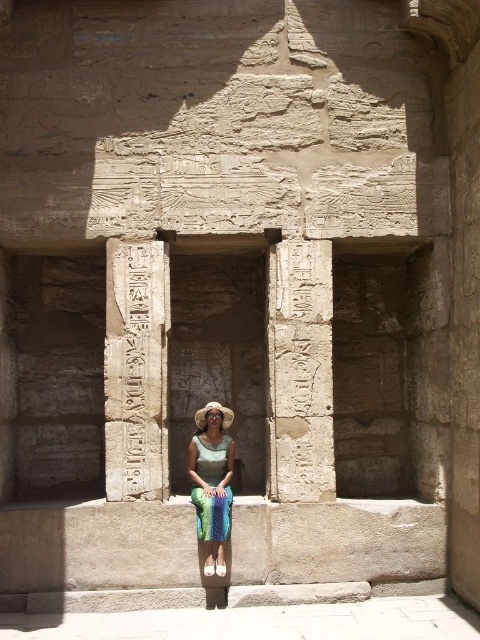
You are an archaeologist examining the ancient temple. You notice two sets of hieroglyphs at the center of the image. Which one is shorter in height between the carved stone hieroglyphs at center and the white stone hieroglyphics at center?

The carved stone hieroglyphs at center is shorter in height compared to the white stone hieroglyphics at center.

You are a tour guide at the temple and want to show visitors the shiny green dress at center and the carved stone hieroglyphs at center. Which object is closer to the camera? Please explain.

The carved stone hieroglyphs at center are closer to the camera than the shiny green dress at center, as the dress is positioned behind the hieroglyphs.